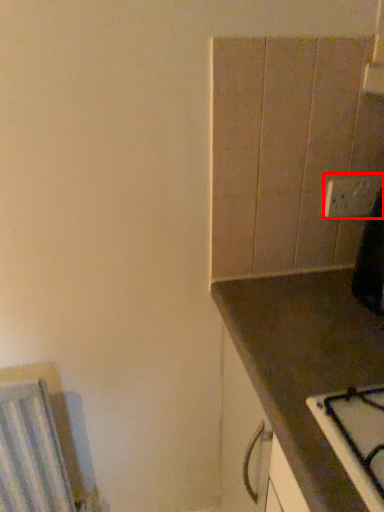
Question: From the image's perspective, considering the relative positions of electric outlet (annotated by the red box) and countertop in the image provided, where is electric outlet (annotated by the red box) located with respect to the staircase?

Choices:
 (A) below
 (B) above

Answer: (B)